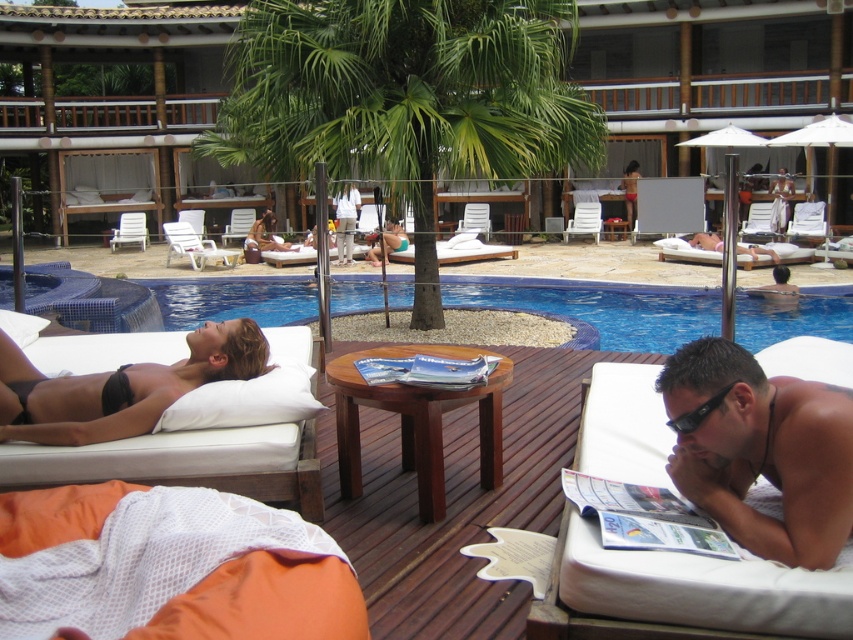
Question: Which point is closer to the camera taking this photo?

Choices:
 (A) (682, 550)
 (B) (370, 154)
 (C) (207, 404)
 (D) (447, 372)

Answer: (A)

Question: Which point is closer to the camera?

Choices:
 (A) white soft pillow at left
 (B) green leafy palm tree at center
 (C) black bikini at upper left
 (D) matte black bikini at center

Answer: (C)

Question: Does white soft pillow at left have a lesser width compared to matte black bikini at center?

Choices:
 (A) no
 (B) yes

Answer: (B)

Question: Does black bikini at upper left appear over matte paper magazine at center?

Choices:
 (A) no
 (B) yes

Answer: (A)

Question: Which point is closer to the camera?

Choices:
 (A) (611, 484)
 (B) (756, 326)
 (C) (683, 424)
 (D) (277, 388)

Answer: (C)

Question: Is black bikini at upper left to the left of matte black bikini at center from the viewer's perspective?

Choices:
 (A) no
 (B) yes

Answer: (A)